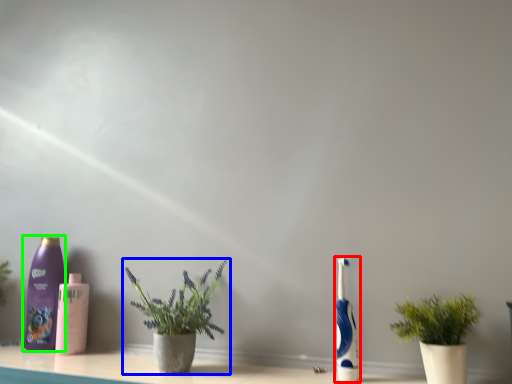
Question: Based on their relative distances, which object is farther from toothbrush (highlighted by a red box)? Choose from houseplant (highlighted by a blue box) and bottle (highlighted by a green box).

Choices:
 (A) houseplant
 (B) bottle

Answer: (B)